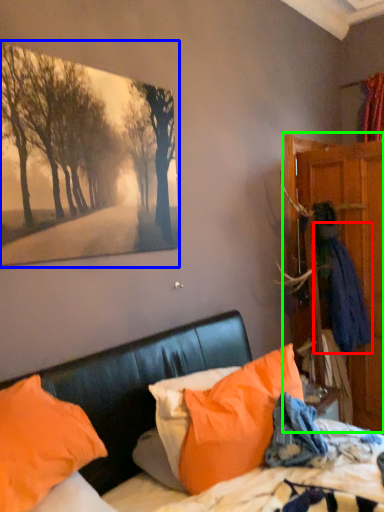
Question: Considering the real-world distances, which object is closest to clothing (highlighted by a red box)? picture frame (highlighted by a blue box) or dresser (highlighted by a green box).

Choices:
 (A) picture frame
 (B) dresser

Answer: (B)